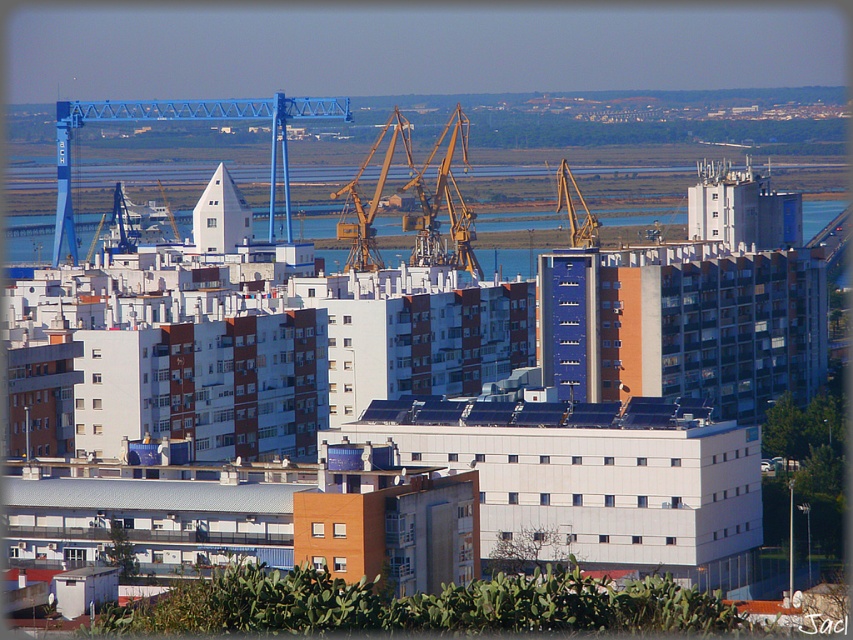
Question: Is matte yellow crane at upper center bigger than blue metallic crane at upper center?

Choices:
 (A) yes
 (B) no

Answer: (A)

Question: Estimate the real-world distances between objects in this image. Which object is farther from the blue metallic crane at upper center?

Choices:
 (A) matte yellow crane at upper center
 (B) blue water at center

Answer: (A)

Question: Which object appears closest to the camera in this image?

Choices:
 (A) blue metallic crane at upper center
 (B) matte yellow crane at upper center
 (C) blue water at center

Answer: (B)

Question: Which object is closer to the camera taking this photo?

Choices:
 (A) blue metallic crane at upper center
 (B) matte yellow crane at upper center

Answer: (B)

Question: Is blue metallic crane at upper center thinner than blue water at center?

Choices:
 (A) no
 (B) yes

Answer: (B)

Question: Is matte yellow crane at upper center positioned behind blue water at center?

Choices:
 (A) yes
 (B) no

Answer: (B)